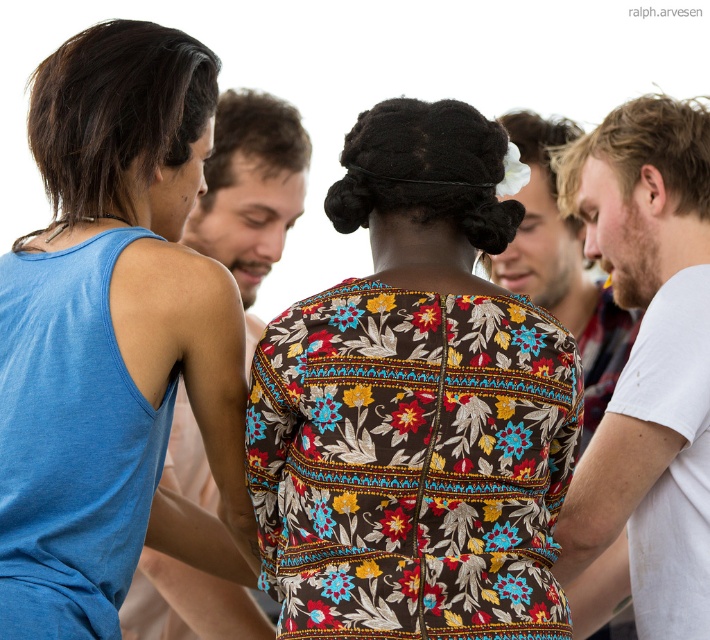
Is matte blue tank top at left wider than white cotton shirt at center?

No, matte blue tank top at left is not wider than white cotton shirt at center.

Does matte blue tank top at left have a lesser width compared to white cotton shirt at center?

Indeed, matte blue tank top at left has a lesser width compared to white cotton shirt at center.

The height and width of the screenshot is (640, 710). I want to click on matte blue tank top at left, so click(x=251, y=186).

Consider the image. Which is above, white cotton t-shirt at right or matte blue tank top at left?

matte blue tank top at left is above.

Consider the image. Between white cotton t-shirt at right and matte blue tank top at left, which one appears on the right side from the viewer's perspective?

white cotton t-shirt at right is more to the right.

Describe the element at coordinates (648, 358) in the screenshot. I see `white cotton t-shirt at right` at that location.

Find the location of a particular element. Image resolution: width=710 pixels, height=640 pixels. white cotton t-shirt at right is located at coordinates (648, 358).

Is blue cotton tank top at left to the right of matte blue tank top at left from the viewer's perspective?

No, blue cotton tank top at left is not to the right of matte blue tank top at left.

Is blue cotton tank top at left below matte blue tank top at left?

Correct, blue cotton tank top at left is located below matte blue tank top at left.

Looking at this image, who is more distant from viewer, [231,289] or [214,625]?

Point [214,625]

Identify the location of blue cotton tank top at left. The height and width of the screenshot is (640, 710). (114, 337).